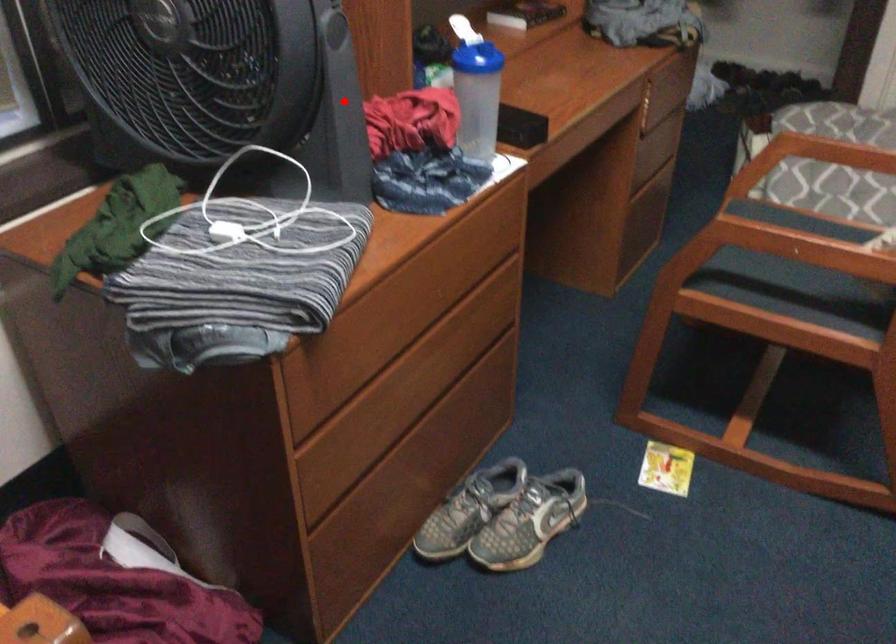
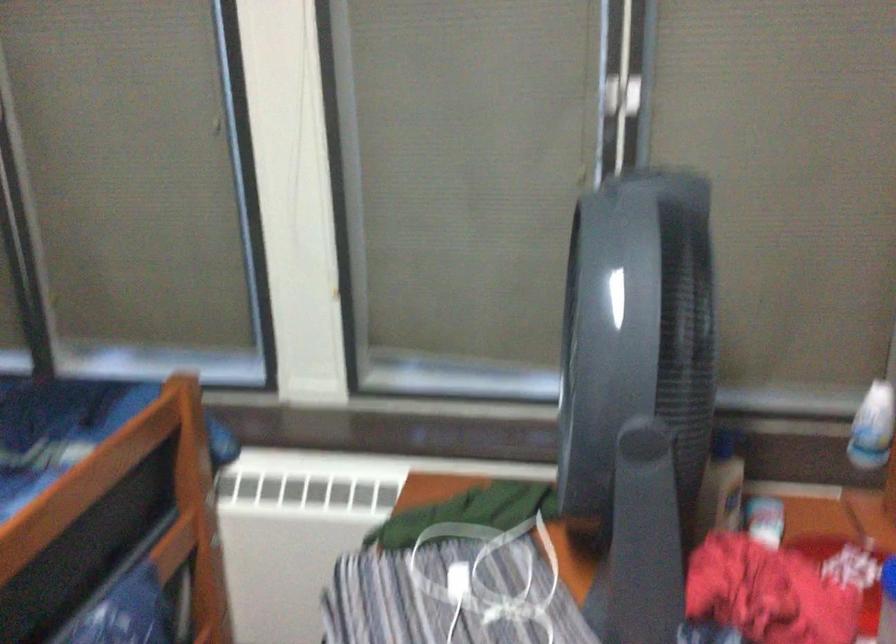
Question: I am providing you with two images of the same scene from different viewpoints. In image1, a red point is highlighted. Considering the same 3D point in image2, which of the following is correct?

Choices:
 (A) It is closer
 (B) It is farther

Answer: (A)